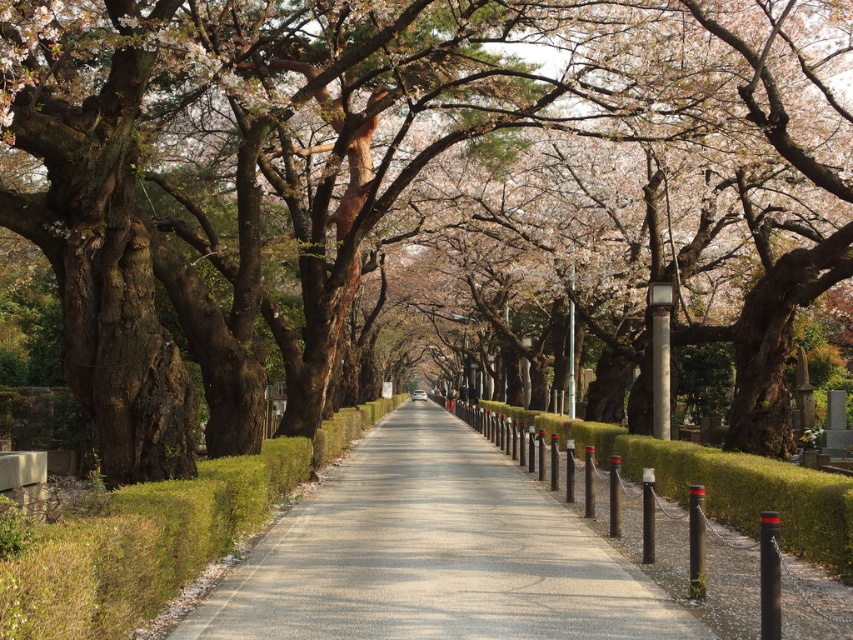
You are standing on the pathway and want to walk to the hedge. Which direction should you move to get to the green grassy hedge at center from the smooth concrete pavement at center?

The smooth concrete pavement at center is positioned on the right side of the green grassy hedge at center, so you should move to the left to reach the green grassy hedge at center.

You are a gardener who needs to trim the green grassy hedge at center and the smooth concrete pavement at center. Which object requires trimming?

The green grassy hedge at center requires trimming since it is taller than the smooth concrete pavement at center.